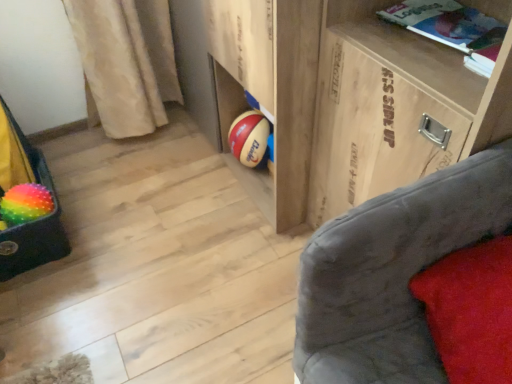
You are a GUI agent. You are given a task and a screenshot of the screen. Output one action in this format:
    pyautogui.click(x=<x>, y=<y>)
    Task: Click on the white paper book at upper right
    
    Given the screenshot: What is the action you would take?
    pyautogui.click(x=452, y=29)

Describe the element at coordinates (471, 310) in the screenshot. I see `red velvet pillow at lower right` at that location.

Find the location of a particular element. This screenshot has height=384, width=512. white paper book at upper right is located at coordinates (452, 29).

Is red velvet pillow at lower right beside rainbow fuzzy bean bag chair at left?

No.

Identify the location of bean bag chair to the left of red velvet pillow at lower right. The height and width of the screenshot is (384, 512). (32, 222).

Which is more to the left, red velvet pillow at lower right or rainbow fuzzy bean bag chair at left?

From the viewer's perspective, rainbow fuzzy bean bag chair at left appears more on the left side.

From the image's perspective, which is below, red velvet pillow at lower right or rainbow fuzzy bean bag chair at left?

From the image's view, red velvet pillow at lower right is below.

Can you see rainbow rubber beach ball at lower left touching white paper book at upper right?

No, rainbow rubber beach ball at lower left is not making contact with white paper book at upper right.

Does point (34, 195) come behind point (466, 19)?

Yes, it is.

Can you confirm if rainbow rubber beach ball at lower left is wider than white paper book at upper right?

No, rainbow rubber beach ball at lower left is not wider than white paper book at upper right.

Is rainbow rubber beach ball at lower left shorter than white paper book at upper right?

Incorrect, the height of rainbow rubber beach ball at lower left does not fall short of that of white paper book at upper right.

Does point (507, 311) appear closer or farther from the camera than point (50, 204)?

Point (507, 311) appears to be closer to the viewer than point (50, 204).

Which object is wider, red velvet pillow at lower right or rainbow rubber beach ball at lower left?

red velvet pillow at lower right is wider.

Is rainbow rubber beach ball at lower left at the back of red velvet pillow at lower right?

red velvet pillow at lower right does not have its back to rainbow rubber beach ball at lower left.

Is red velvet pillow at lower right closer to the viewer compared to rainbow rubber beach ball at lower left?

Yes, the depth of red velvet pillow at lower right is less than that of rainbow rubber beach ball at lower left.

Would you say rainbow rubber beach ball at lower left is a long distance from rainbow fuzzy bean bag chair at left?

No, rainbow rubber beach ball at lower left is not far from rainbow fuzzy bean bag chair at left.

Is rainbow rubber beach ball at lower left taller than rainbow fuzzy bean bag chair at left?

In fact, rainbow rubber beach ball at lower left may be shorter than rainbow fuzzy bean bag chair at left.

Is rainbow rubber beach ball at lower left inside or outside of rainbow fuzzy bean bag chair at left?

rainbow rubber beach ball at lower left can be found inside rainbow fuzzy bean bag chair at left.

Does rainbow rubber beach ball at lower left have a larger size compared to rainbow fuzzy bean bag chair at left?

Actually, rainbow rubber beach ball at lower left might be smaller than rainbow fuzzy bean bag chair at left.

Which is closer, (x=33, y=223) or (x=481, y=73)?

The point (x=481, y=73) is in front.

Is rainbow fuzzy bean bag chair at left wider or thinner than white paper book at upper right?

rainbow fuzzy bean bag chair at left is wider than white paper book at upper right.

Considering the relative sizes of rainbow fuzzy bean bag chair at left and white paper book at upper right in the image provided, is rainbow fuzzy bean bag chair at left bigger than white paper book at upper right?

Yes, rainbow fuzzy bean bag chair at left is bigger than white paper book at upper right.

From the image's perspective, is white paper book at upper right on rainbow fuzzy bean bag chair at left?

Yes, from the image's perspective, white paper book at upper right is above rainbow fuzzy bean bag chair at left.

Does white paper book at upper right have a larger size compared to rainbow fuzzy bean bag chair at left?

Incorrect, white paper book at upper right is not larger than rainbow fuzzy bean bag chair at left.

In terms of width, does white paper book at upper right look wider or thinner when compared to rainbow fuzzy bean bag chair at left?

Clearly, white paper book at upper right has less width compared to rainbow fuzzy bean bag chair at left.

Is there a large distance between white paper book at upper right and rainbow fuzzy bean bag chair at left?

Absolutely, white paper book at upper right is distant from rainbow fuzzy bean bag chair at left.

Are wooden at center and red velvet pillow at lower right making contact?

There is a gap between wooden at center and red velvet pillow at lower right.

Considering the relative positions of wooden at center and red velvet pillow at lower right in the image provided, is wooden at center to the left or to the right of red velvet pillow at lower right?

wooden at center is to the left of red velvet pillow at lower right.

Is wooden at center oriented away from red velvet pillow at lower right?

No, wooden at center is not facing away from red velvet pillow at lower right.

Which of these two, wooden at center or red velvet pillow at lower right, stands taller?

Standing taller between the two is wooden at center.

Find the location of `pillow above the rainbow fuzzy bean bag chair at left (from a real-world perspective)`. pillow above the rainbow fuzzy bean bag chair at left (from a real-world perspective) is located at coordinates [x=471, y=310].

Find the location of a particular element. The width and height of the screenshot is (512, 384). book in front of the rainbow rubber beach ball at lower left is located at coordinates (452, 29).

Looking at the image, which one is located closer to white paper book at upper right, wooden at center or rainbow fuzzy bean bag chair at left?

wooden at center is closer to white paper book at upper right.

Based on their spatial positions, is rainbow rubber beach ball at lower left or red velvet pillow at lower right further from wooden at center?

Among the two, rainbow rubber beach ball at lower left is located further to wooden at center.

Looking at the image, which one is located closer to wooden at center, white paper book at upper right or rainbow rubber beach ball at lower left?

Among the two, white paper book at upper right is located nearer to wooden at center.

Estimate the real-world distances between objects in this image. Which object is further from wooden at center, rainbow fuzzy bean bag chair at left or red velvet pillow at lower right?

rainbow fuzzy bean bag chair at left is further to wooden at center.

Based on their spatial positions, is wooden at center or rainbow rubber beach ball at lower left closer to white paper book at upper right?

The object closer to white paper book at upper right is wooden at center.

In the scene shown: Estimate the real-world distances between objects in this image. Which object is closer to white paper book at upper right, rainbow rubber beach ball at lower left or red velvet pillow at lower right?

The object closer to white paper book at upper right is red velvet pillow at lower right.

Considering their positions, is rainbow rubber beach ball at lower left positioned closer to rainbow fuzzy bean bag chair at left than wooden at center?

The object closer to rainbow fuzzy bean bag chair at left is rainbow rubber beach ball at lower left.

When comparing their distances from white paper book at upper right, does red velvet pillow at lower right or rainbow rubber beach ball at lower left seem further?

rainbow rubber beach ball at lower left is further to white paper book at upper right.

I want to click on shelf situated between rainbow fuzzy bean bag chair at left and white paper book at upper right from left to right, so click(329, 83).

Image resolution: width=512 pixels, height=384 pixels. What are the coordinates of `shelf between rainbow fuzzy bean bag chair at left and red velvet pillow at lower right` in the screenshot? It's located at (329, 83).

Identify the location of shelf situated between rainbow rubber beach ball at lower left and red velvet pillow at lower right from left to right. The image size is (512, 384). (329, 83).

Where is `beach ball located between rainbow fuzzy bean bag chair at left and white paper book at upper right in the left-right direction`? beach ball located between rainbow fuzzy bean bag chair at left and white paper book at upper right in the left-right direction is located at coordinates (25, 204).